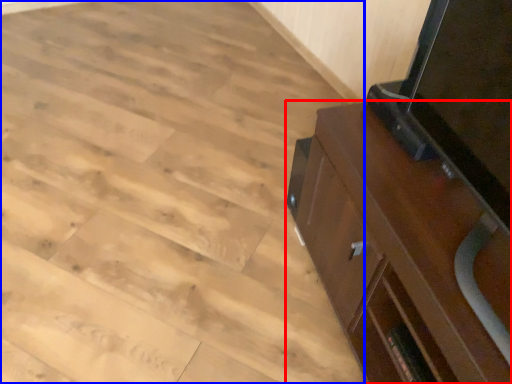
Question: Which point is closer to the camera, cabinetry (highlighted by a red box) or plywood (highlighted by a blue box)?

Choices:
 (A) cabinetry
 (B) plywood

Answer: (A)